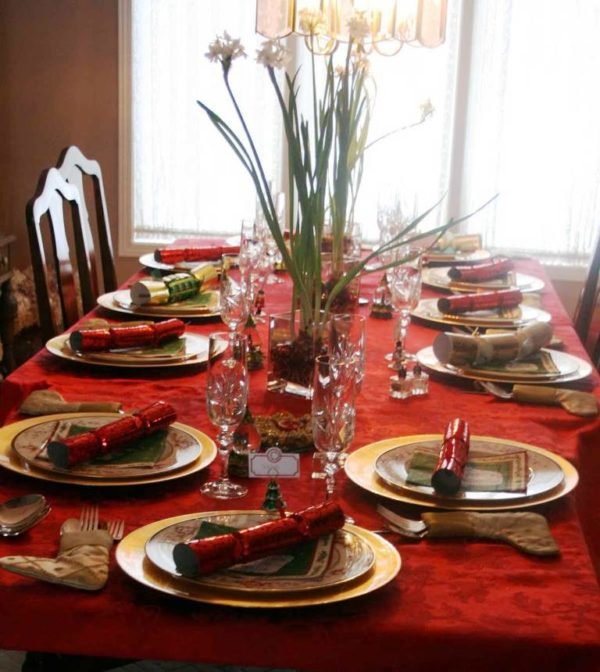
You are a GUI agent. You are given a task and a screenshot of the screen. Output one action in this format:
    pyautogui.click(x=<x>, y=<y>)
    Task: Click on the stocking
    The height and width of the screenshot is (672, 600).
    Given the screenshot: What is the action you would take?
    pyautogui.click(x=78, y=566), pyautogui.click(x=521, y=531), pyautogui.click(x=548, y=394), pyautogui.click(x=64, y=407), pyautogui.click(x=101, y=321)